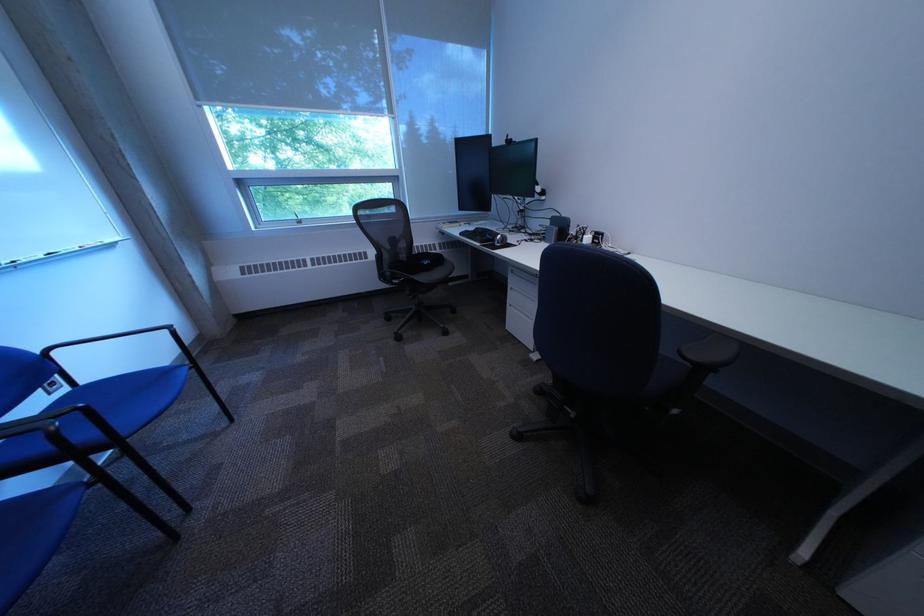
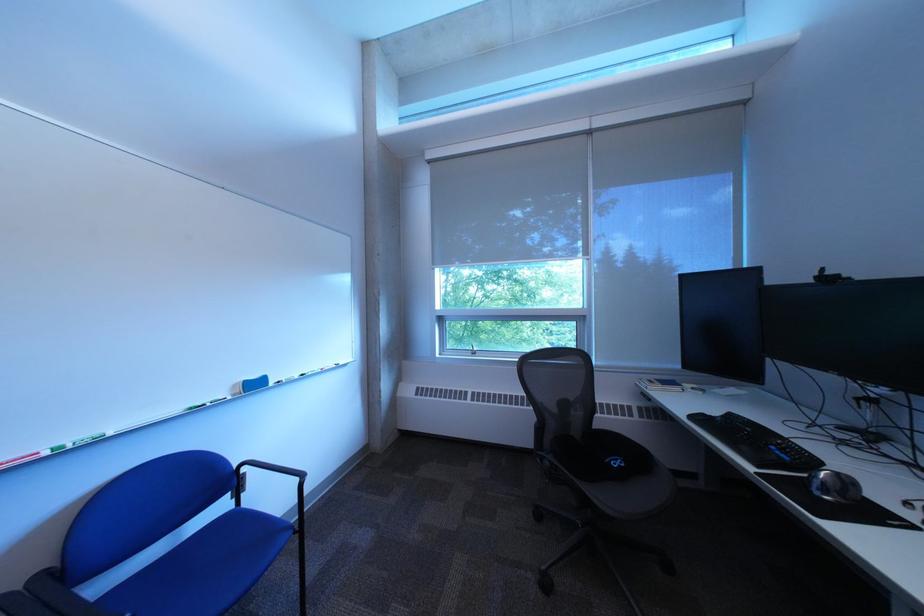
Find the pixel in the second image that matches point 514,245 in the first image.

(841, 493)